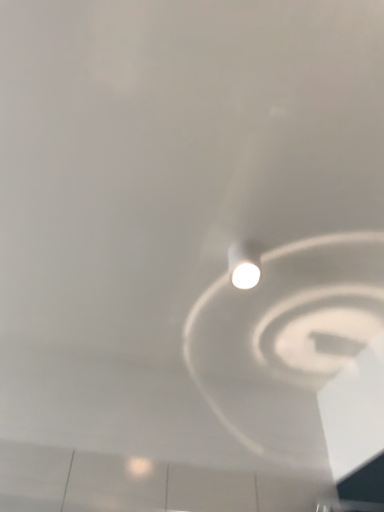
The height and width of the screenshot is (512, 384). What do you see at coordinates (244, 264) in the screenshot? I see `white glossy light bulb at center` at bounding box center [244, 264].

The height and width of the screenshot is (512, 384). Find the location of `white glossy light bulb at center`. white glossy light bulb at center is located at coordinates (244, 264).

You are a GUI agent. You are given a task and a screenshot of the screen. Output one action in this format:
    pyautogui.click(x=<x>, y=<y>)
    Task: Click on the white glossy light bulb at center
    This screenshot has width=384, height=512.
    Given the screenshot: What is the action you would take?
    pyautogui.click(x=244, y=264)